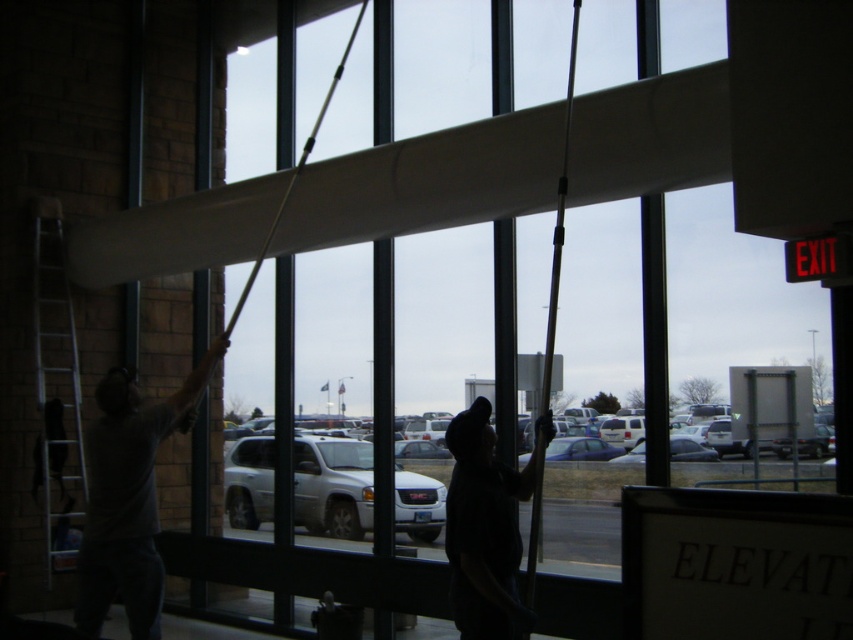
Question: From the image, what is the correct spatial relationship of dark gray shirt at left in relation to silver metallic ladder at left?

Choices:
 (A) above
 (B) below

Answer: (B)

Question: Is dark gray shirt at left closer to camera compared to silver metallic ladder at left?

Choices:
 (A) yes
 (B) no

Answer: (A)

Question: From the image, what is the correct spatial relationship of white smooth beam at center in relation to dark gray fabric at center?

Choices:
 (A) above
 (B) below

Answer: (A)

Question: Which of these objects is positioned closest to the dark gray shirt at left?

Choices:
 (A) white smooth beam at center
 (B) dark gray fabric at center
 (C) silver metallic ladder at left

Answer: (A)

Question: Among these objects, which one is farthest from the camera?

Choices:
 (A) dark gray shirt at left
 (B) dark gray fabric at center
 (C) white smooth beam at center

Answer: (A)

Question: Considering the real-world distances, which object is closest to the white smooth beam at center?

Choices:
 (A) dark gray fabric at center
 (B) dark gray shirt at left
 (C) silver metallic ladder at left

Answer: (C)